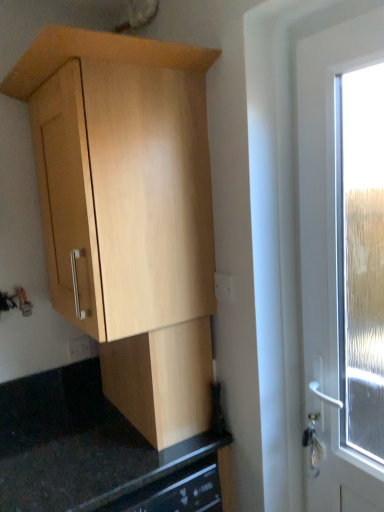
I want to click on vacant space underneath light wood cabinet at upper left, which ranks as the 1th cabinetry in top-to-bottom order (from a real-world perspective), so [x=123, y=440].